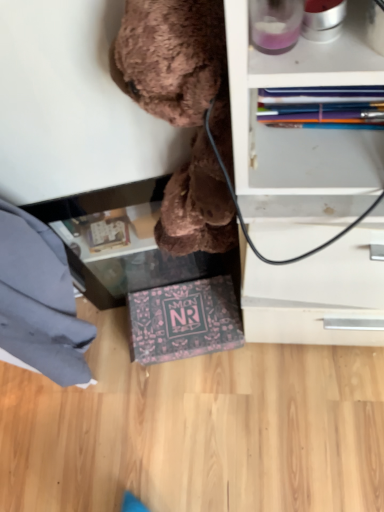
This screenshot has width=384, height=512. Describe the element at coordinates (99, 200) in the screenshot. I see `transparent glass table at lower center` at that location.

What do you see at coordinates (71, 105) in the screenshot?
I see `brown plush toy at upper center` at bounding box center [71, 105].

This screenshot has height=512, width=384. Find the location of `dark blue fabric at lower left`. dark blue fabric at lower left is located at coordinates (39, 298).

Can you confirm if dark blue fabric at lower left is positioned to the right of transparent glass table at lower center?

No, dark blue fabric at lower left is not to the right of transparent glass table at lower center.

Can you tell me how much dark blue fabric at lower left and transparent glass table at lower center differ in facing direction?

12.7 degrees.

Can transparent glass table at lower center be found inside dark blue fabric at lower left?

No, transparent glass table at lower center is not surrounded by dark blue fabric at lower left.

Is dark blue fabric at lower left oriented towards transparent glass table at lower center?

No, dark blue fabric at lower left does not turn towards transparent glass table at lower center.

Is point (52, 271) more distant than point (49, 83)?

Yes.

Is dark blue fabric at lower left oriented towards brown plush toy at upper center?

No, dark blue fabric at lower left is not oriented towards brown plush toy at upper center.

Which of these two, dark blue fabric at lower left or brown plush toy at upper center, stands shorter?

brown plush toy at upper center.

Can we say transparent glass table at lower center lies outside dark blue fabric at lower left?

Yes, transparent glass table at lower center is not within dark blue fabric at lower left.

Consider the image. Does transparent glass table at lower center appear on the right side of dark blue fabric at lower left?

Yes, transparent glass table at lower center is to the right of dark blue fabric at lower left.

This screenshot has height=512, width=384. I want to click on table located behind the dark blue fabric at lower left, so click(99, 200).

In the scene shown: How distant is transparent glass table at lower center from dark blue fabric at lower left?

7.34 inches.

How many degrees apart are the facing directions of brown plush toy at upper center and dark blue fabric at lower left?

5.41 degrees separate the facing orientations of brown plush toy at upper center and dark blue fabric at lower left.

Is brown plush toy at upper center aimed at dark blue fabric at lower left?

No.

Is brown plush toy at upper center positioned beyond the bounds of dark blue fabric at lower left?

Yes, brown plush toy at upper center is outside of dark blue fabric at lower left.

Is brown plush toy at upper center further to camera compared to dark blue fabric at lower left?

No, brown plush toy at upper center is closer to the camera.

In terms of height, does brown plush toy at upper center look taller or shorter compared to transparent glass table at lower center?

brown plush toy at upper center is taller than transparent glass table at lower center.

From the image's perspective, is brown plush toy at upper center on transparent glass table at lower center?

Yes.

At what (x,y) coordinates should I click in order to perform the action: click on shelf that is above the transparent glass table at lower center (from the image's perspective). Please return your answer as a coordinate pair (x, y). Looking at the image, I should click on (71, 105).

In terms of size, does brown plush toy at upper center appear bigger or smaller than transparent glass table at lower center?

Considering their sizes, brown plush toy at upper center takes up less space than transparent glass table at lower center.

Is the surface of transparent glass table at lower center in direct contact with brown plush toy at upper center?

No.

Can you tell me how much transparent glass table at lower center and brown plush toy at upper center differ in facing direction?

7.3 degrees.

From the image's perspective, which object appears higher, transparent glass table at lower center or brown plush toy at upper center?

brown plush toy at upper center appears higher in the image.

Could you tell me if transparent glass table at lower center is turned towards brown plush toy at upper center?

No, transparent glass table at lower center is not turned towards brown plush toy at upper center.

Locate an element on the screen. This screenshot has height=512, width=384. clothe located on the left of transparent glass table at lower center is located at coordinates (39, 298).

Where is `clothe beneath the brown plush toy at upper center (from a real-world perspective)`? clothe beneath the brown plush toy at upper center (from a real-world perspective) is located at coordinates (39, 298).

Which object lies further to the anchor point brown plush toy at upper center, dark blue fabric at lower left or transparent glass table at lower center?

Based on the image, dark blue fabric at lower left appears to be further to brown plush toy at upper center.

From the image, which object appears to be farther from dark blue fabric at lower left, brown plush toy at upper center or transparent glass table at lower center?

Based on the image, brown plush toy at upper center appears to be further to dark blue fabric at lower left.

From the image, which object appears to be farther from transparent glass table at lower center, brown plush toy at upper center or dark blue fabric at lower left?

brown plush toy at upper center lies further to transparent glass table at lower center than the other object.

In the scene shown: Which object lies further to the anchor point transparent glass table at lower center, dark blue fabric at lower left or brown plush toy at upper center?

Based on the image, brown plush toy at upper center appears to be further to transparent glass table at lower center.

From the image, which object appears to be nearer to brown plush toy at upper center, transparent glass table at lower center or dark blue fabric at lower left?

The object closer to brown plush toy at upper center is transparent glass table at lower center.

Looking at the image, which one is located further to dark blue fabric at lower left, transparent glass table at lower center or brown plush toy at upper center?

brown plush toy at upper center.

The height and width of the screenshot is (512, 384). Find the location of `clothe positioned between brown plush toy at upper center and transparent glass table at lower center from near to far`. clothe positioned between brown plush toy at upper center and transparent glass table at lower center from near to far is located at coordinates (39, 298).